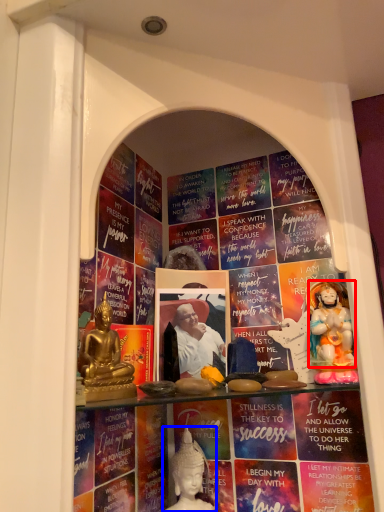
Question: Which object is closer to the camera taking this photo, person (highlighted by a red box) or person (highlighted by a blue box)?

Choices:
 (A) person
 (B) person

Answer: (A)